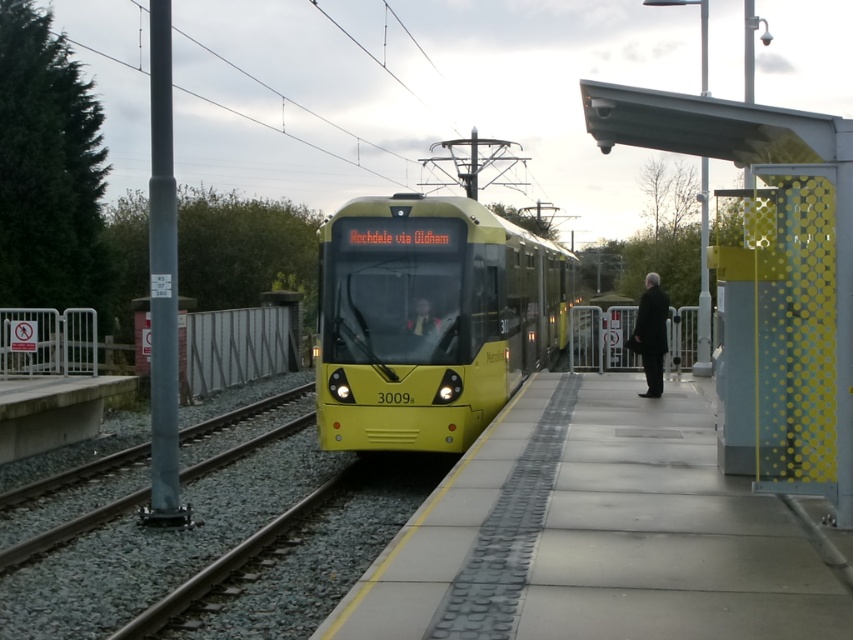
Question: Estimate the real-world distances between objects in this image. Which object is farther from the yellow metallic train at center?

Choices:
 (A) smooth concrete platform at center
 (B) black wool coat at right

Answer: (A)

Question: Can you confirm if smooth concrete platform at center is positioned to the left of black wool coat at right?

Choices:
 (A) yes
 (B) no

Answer: (A)

Question: Among these objects, which one is farthest from the camera?

Choices:
 (A) yellow metallic train at center
 (B) smooth concrete platform at center

Answer: (A)

Question: Is yellow metallic train at center closer to the viewer compared to black wool coat at right?

Choices:
 (A) no
 (B) yes

Answer: (B)

Question: Is smooth concrete platform at center to the left of yellow metallic train at center from the viewer's perspective?

Choices:
 (A) no
 (B) yes

Answer: (A)

Question: Which point appears closest to the camera in this image?

Choices:
 (A) (646, 388)
 (B) (531, 358)
 (C) (540, 433)

Answer: (C)